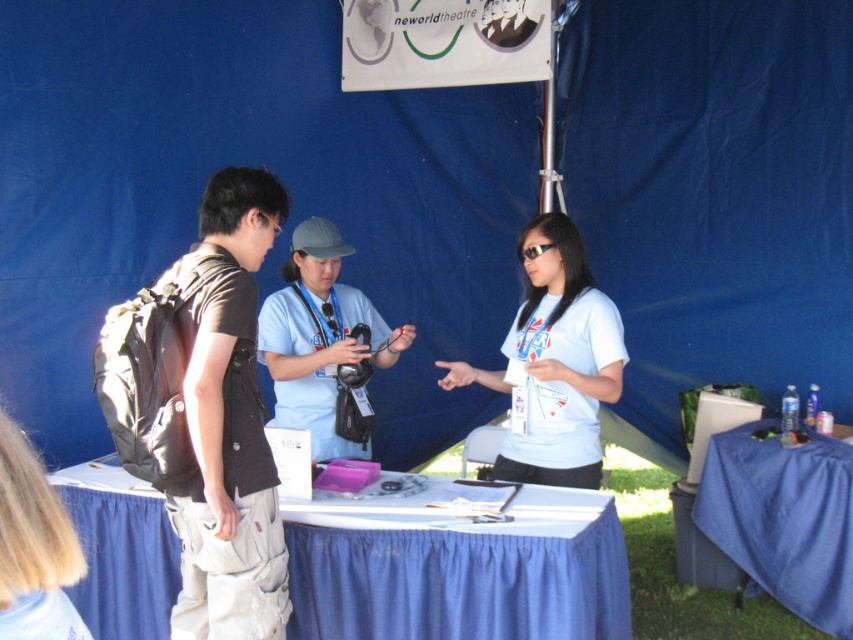
This screenshot has height=640, width=853. Find the location of `white matte t-shirt at center`. white matte t-shirt at center is located at coordinates point(560,358).

Which is below, white matte t-shirt at center or light blue fabric shirt at center?

white matte t-shirt at center is lower down.

Locate an element on the screen. The image size is (853, 640). white matte t-shirt at center is located at coordinates (560, 358).

Measure the distance from dark brown fabric backpack at left to light blue fabric shirt at center.

dark brown fabric backpack at left and light blue fabric shirt at center are 30.32 inches apart.

Is the position of dark brown fabric backpack at left more distant than that of light blue fabric shirt at center?

No, it is not.

What do you see at coordinates (228, 426) in the screenshot? I see `dark brown fabric backpack at left` at bounding box center [228, 426].

Locate an element on the screen. dark brown fabric backpack at left is located at coordinates 228,426.

Can you confirm if blue fabric table at center is positioned below light blue fabric shirt at center?

Yes.

Looking at this image, measure the distance between point (x=291, y=541) and camera.

Point (x=291, y=541) and camera are 8.62 feet apart from each other.

Between point (419, 632) and point (360, 348), which one is positioned in front?

Point (419, 632) is more forward.

This screenshot has width=853, height=640. I want to click on blue fabric table at center, so click(459, 577).